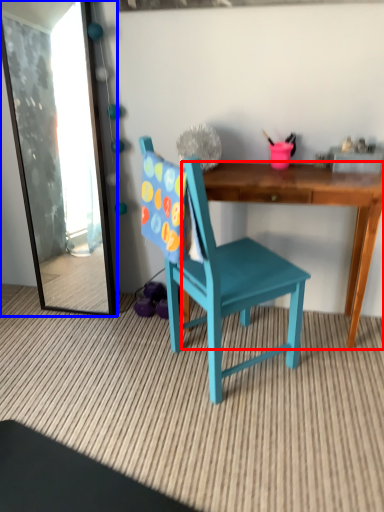
Question: Among these objects, which one is nearest to the camera, desk (highlighted by a red box) or mirror (highlighted by a blue box)?

Choices:
 (A) desk
 (B) mirror

Answer: (A)